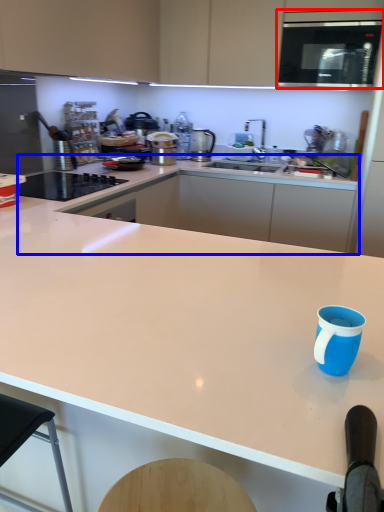
Question: Among these objects, which one is farthest to the camera, microwave oven (highlighted by a red box) or countertop (highlighted by a blue box)?

Choices:
 (A) microwave oven
 (B) countertop

Answer: (B)